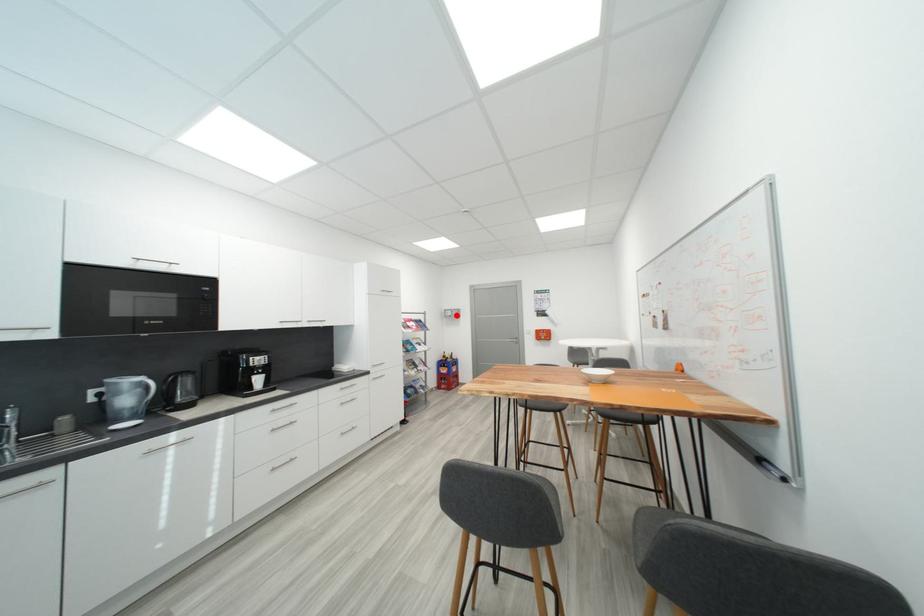
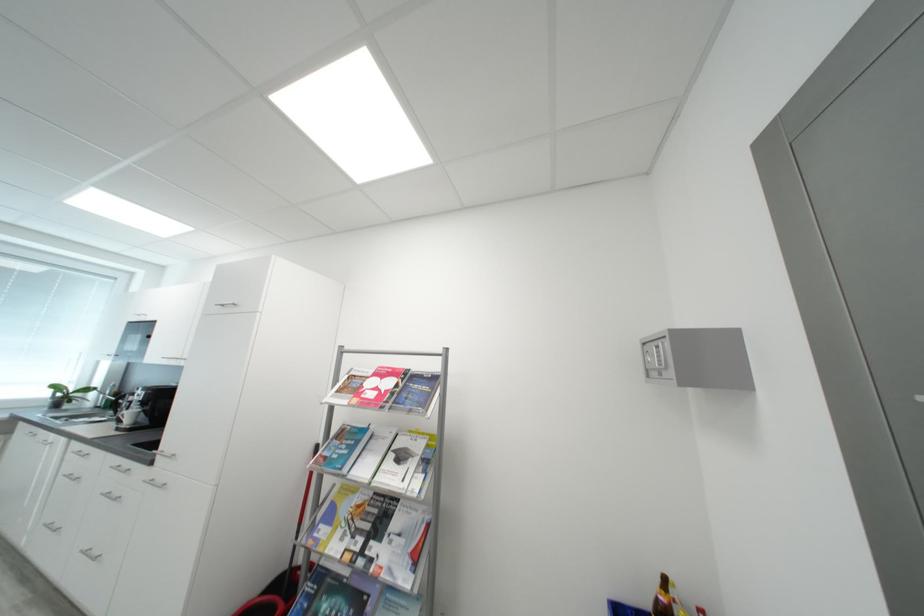
Where in the second image is the point corresponding to the highlighted location from the first image?

(660, 361)